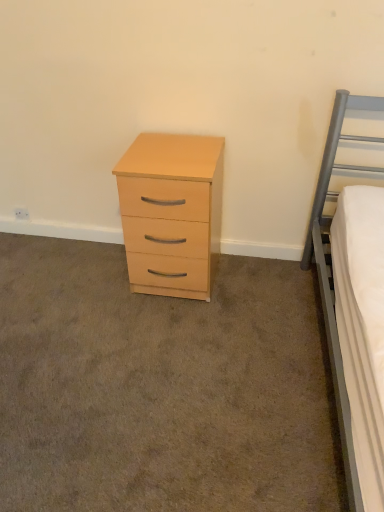
At what (x,y) coordinates should I click in order to perform the action: click on vacant area located to the right-hand side of light wood/veneer chest of drawers at center. Please return your answer as a coordinate pair (x, y). The width and height of the screenshot is (384, 512). Looking at the image, I should click on (253, 285).